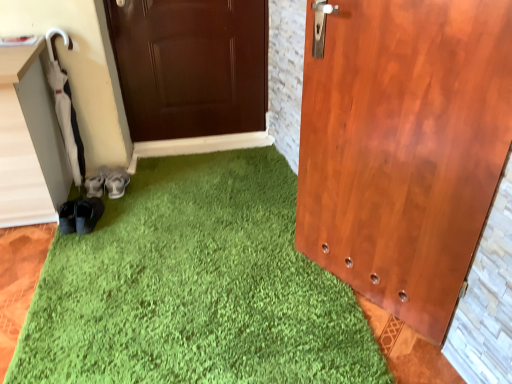
Question: From a real-world perspective, is gray fabric shoes at lower left, positioned as the first footwear in right-to-left order, located higher than suede gray shoes at lower left, the 2th footwear in the right-to-left sequence?

Choices:
 (A) yes
 (B) no

Answer: (A)

Question: Are gray fabric shoes at lower left, positioned as the first footwear in right-to-left order, and suede gray shoes at lower left, the 2th footwear in the right-to-left sequence, far apart?

Choices:
 (A) no
 (B) yes

Answer: (A)

Question: Is gray fabric shoes at lower left, which ranks as the second footwear in left-to-right order, looking in the opposite direction of suede gray shoes at lower left, the 1th footwear viewed from the left?

Choices:
 (A) no
 (B) yes

Answer: (A)

Question: Is gray fabric shoes at lower left, which ranks as the second footwear in left-to-right order, to the right of suede gray shoes at lower left, the 1th footwear viewed from the left, from the viewer's perspective?

Choices:
 (A) no
 (B) yes

Answer: (B)

Question: Can you see gray fabric shoes at lower left, which ranks as the second footwear in left-to-right order, touching suede gray shoes at lower left, the 2th footwear in the right-to-left sequence?

Choices:
 (A) no
 (B) yes

Answer: (B)

Question: From the image's perspective, is gray fabric shoes at lower left, positioned as the first footwear in right-to-left order, located above suede gray shoes at lower left, the 2th footwear in the right-to-left sequence?

Choices:
 (A) yes
 (B) no

Answer: (A)

Question: Is suede gray shoes at lower left, the 2th footwear in the right-to-left sequence, to the right of gray fabric shoes at lower left, positioned as the first footwear in right-to-left order, from the viewer's perspective?

Choices:
 (A) no
 (B) yes

Answer: (A)

Question: Is gray fabric shoes at lower left, which ranks as the second footwear in left-to-right order, inside suede gray shoes at lower left, the 2th footwear in the right-to-left sequence?

Choices:
 (A) no
 (B) yes

Answer: (A)

Question: Is suede gray shoes at lower left, the 2th footwear in the right-to-left sequence, at the left side of gray fabric shoes at lower left, which ranks as the second footwear in left-to-right order?

Choices:
 (A) no
 (B) yes

Answer: (B)

Question: Does suede gray shoes at lower left, the 2th footwear in the right-to-left sequence, lie in front of gray fabric shoes at lower left, positioned as the first footwear in right-to-left order?

Choices:
 (A) yes
 (B) no

Answer: (B)

Question: Is suede gray shoes at lower left, the 2th footwear in the right-to-left sequence, behind gray fabric shoes at lower left, which ranks as the second footwear in left-to-right order?

Choices:
 (A) yes
 (B) no

Answer: (A)

Question: From a real-world perspective, is suede gray shoes at lower left, the 1th footwear viewed from the left, on gray fabric shoes at lower left, which ranks as the second footwear in left-to-right order?

Choices:
 (A) yes
 (B) no

Answer: (B)

Question: Is point (108, 170) closer or farther from the camera than point (128, 180)?

Choices:
 (A) closer
 (B) farther

Answer: (B)